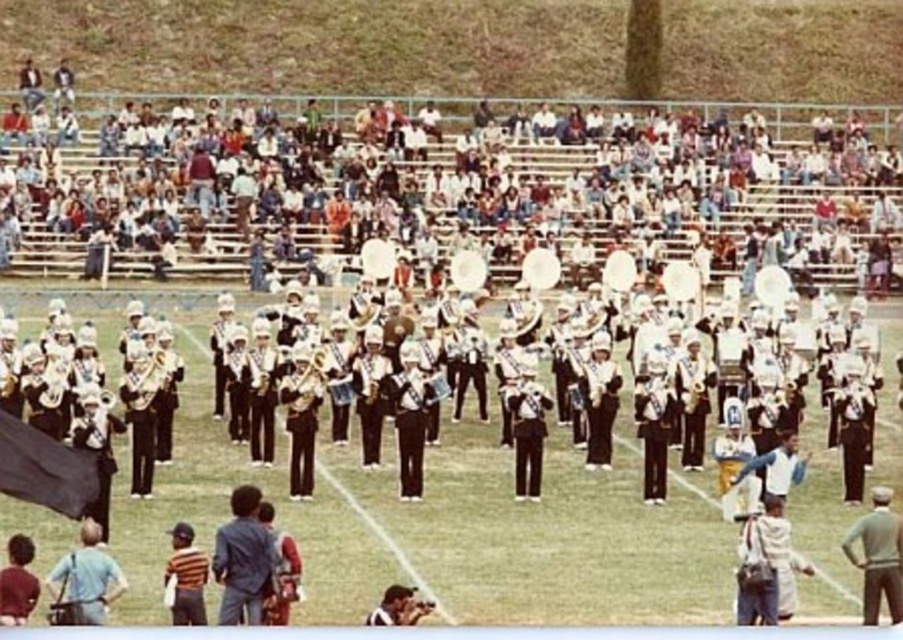
Question: Which of these objects is positioned closest to the blue fabric jacket at lower center?

Choices:
 (A) striped shirt at lower left
 (B) matte silver trumpet at center
 (C) maroon fabric shirt at lower left
 (D) light blue shirt at lower left

Answer: (A)

Question: Which point is farther from the camera taking this photo?

Choices:
 (A) (180, 524)
 (B) (870, 525)

Answer: (B)

Question: From the image, what is the correct spatial relationship of maroon fabric shirt at lower left in relation to matte silver trumpet at center?

Choices:
 (A) above
 (B) below

Answer: (B)

Question: Is maroon fabric shirt at lower left bigger than light brown leather jacket at lower center?

Choices:
 (A) no
 (B) yes

Answer: (B)

Question: Which point appears closest to the camera in this image?

Choices:
 (A) (263, 272)
 (B) (8, 547)
 (C) (89, 596)

Answer: (C)

Question: Is maroon fabric shirt at lower left wider than matte silver trumpet at center?

Choices:
 (A) yes
 (B) no

Answer: (B)